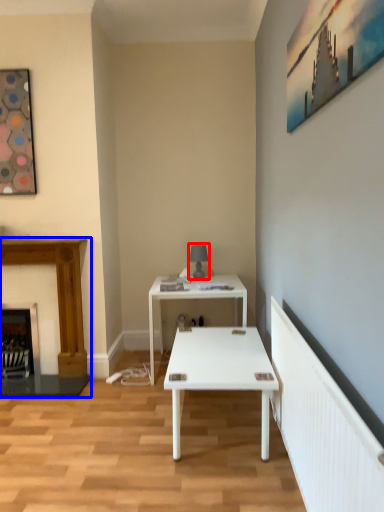
Question: Which point is closer to the camera, table lamp (highlighted by a red box) or fireplace (highlighted by a blue box)?

Choices:
 (A) table lamp
 (B) fireplace

Answer: (B)